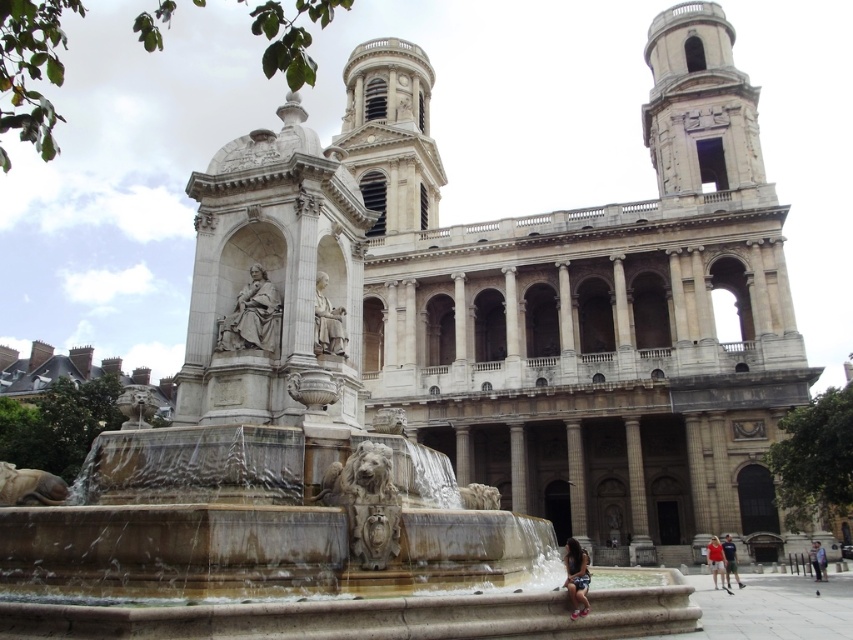
You are a tourist visiting the cathedral and notice an item at the lower center of the scene. What is the exact location of the dark brown leather jacket at lower center in the image coordinates?

The dark brown leather jacket at lower center is located at point coordinates of (576,577).